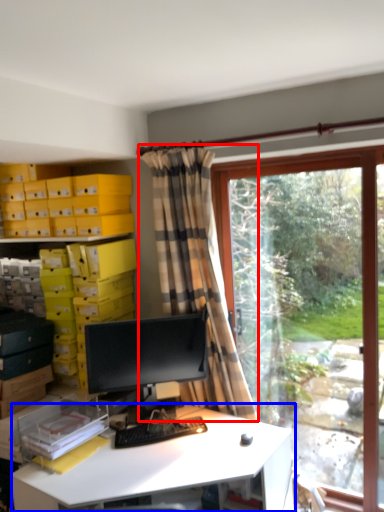
Question: Which of the following is the closest to the observer, curtain (highlighted by a red box) or desk (highlighted by a blue box)?

Choices:
 (A) curtain
 (B) desk

Answer: (B)